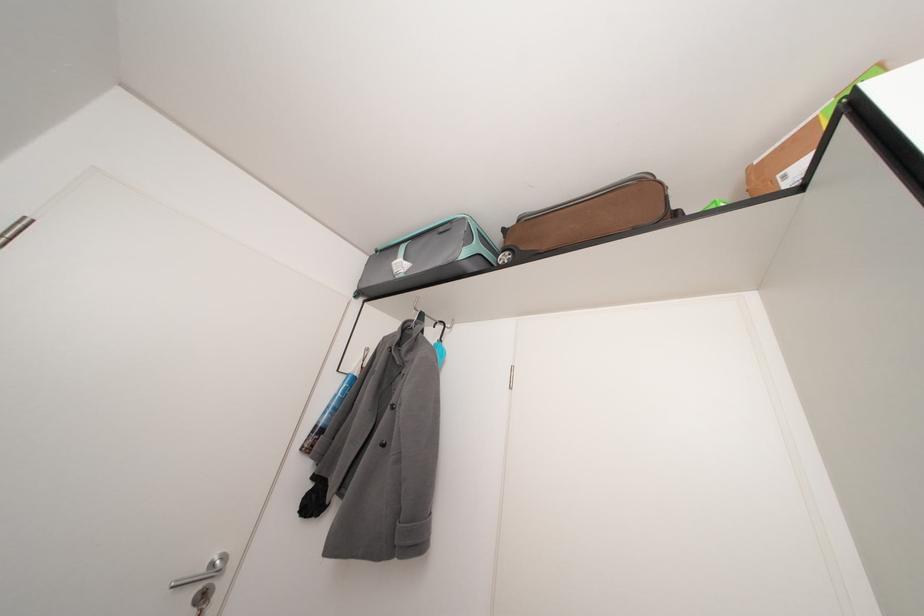
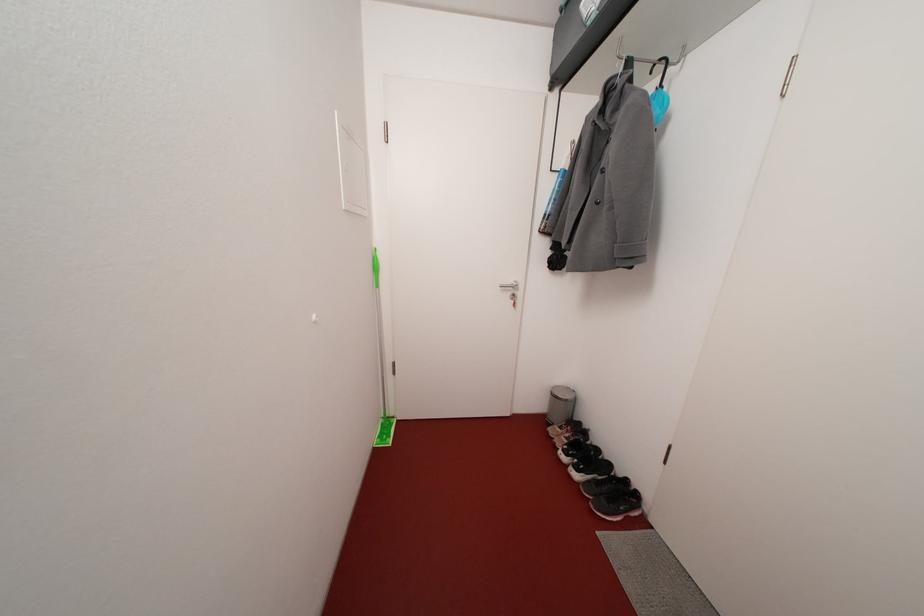
In the second image, find the point that corresponds to (386,254) in the first image.

(570, 7)